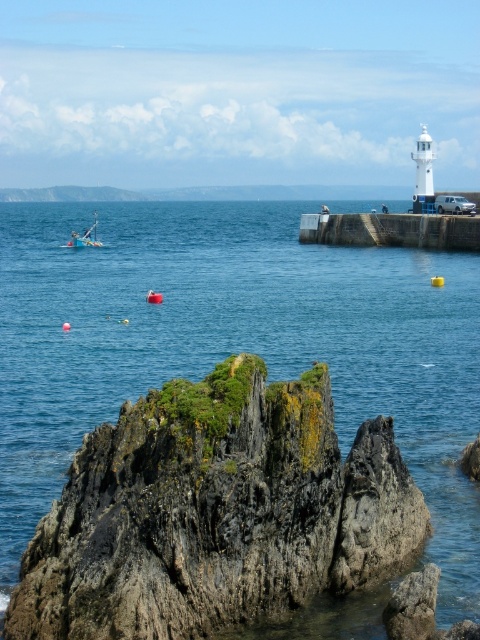
Question: Is the position of blue water at center less distant than that of concrete at right?

Choices:
 (A) no
 (B) yes

Answer: (B)

Question: Among these points, which one is nearest to the camera?

Choices:
 (A) (86, 228)
 (B) (116, 362)
 (C) (355, 227)

Answer: (B)

Question: Which object appears closest to the camera in this image?

Choices:
 (A) concrete at right
 (B) blue water at center

Answer: (B)

Question: Estimate the real-world distances between objects in this image. Which object is farther from the blue water at center?

Choices:
 (A) yellow plastic boat at left
 (B) concrete at right

Answer: (A)

Question: Can you confirm if blue water at center is thinner than yellow plastic boat at left?

Choices:
 (A) yes
 (B) no

Answer: (B)

Question: Is blue water at center below concrete at right?

Choices:
 (A) yes
 (B) no

Answer: (A)